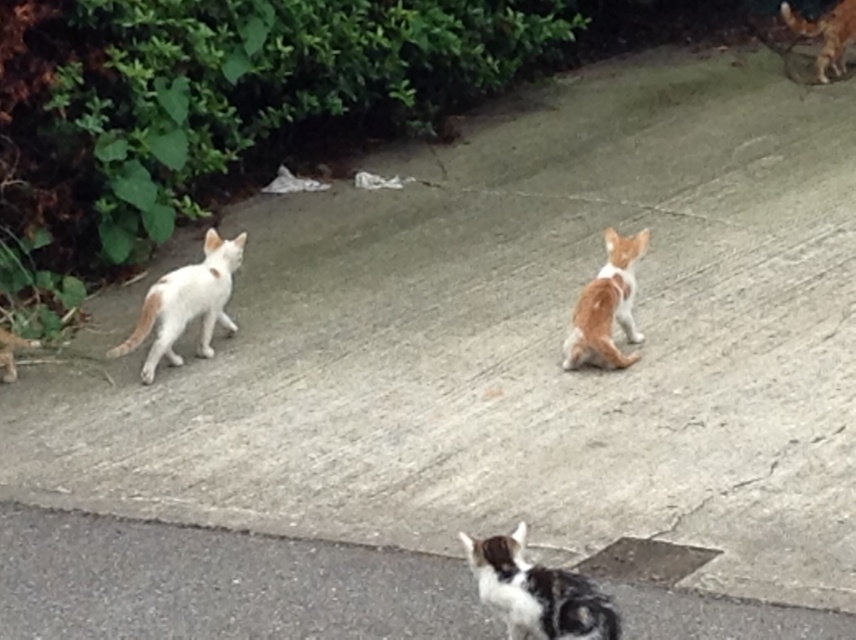
Question: Which of these objects is positioned closest to the white fur cat at left?

Choices:
 (A) calico fur cat at lower center
 (B) orange fur cat at upper right
 (C) orange fur cat at center
 (D) smooth asphalt at lower center

Answer: (D)

Question: Does white fur cat at left have a lesser width compared to orange fur cat at upper right?

Choices:
 (A) yes
 (B) no

Answer: (B)

Question: Which of the following is the farthest from the observer?

Choices:
 (A) (816, 26)
 (B) (506, 627)
 (C) (593, 328)

Answer: (A)

Question: Can you confirm if smooth asphalt at lower center is positioned below calico fur cat at lower center?

Choices:
 (A) no
 (B) yes

Answer: (B)

Question: Which is farther from the orange fur cat at upper right?

Choices:
 (A) white fur cat at left
 (B) orange fur cat at center
 (C) smooth asphalt at lower center

Answer: (C)

Question: Does white fur cat at left lie behind orange fur cat at upper right?

Choices:
 (A) yes
 (B) no

Answer: (B)